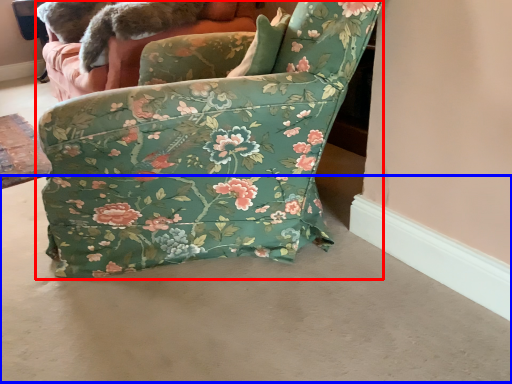
Question: Which of the following is the farthest to the observer, chair (highlighted by a red box) or concrete (highlighted by a blue box)?

Choices:
 (A) chair
 (B) concrete

Answer: (A)